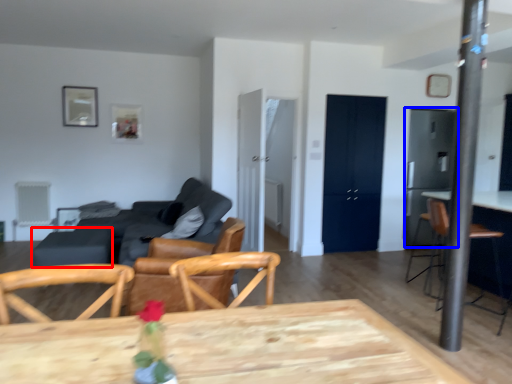
Question: Which point is closer to the camera, table (highlighted by a red box) or appliance (highlighted by a blue box)?

Choices:
 (A) table
 (B) appliance

Answer: (A)